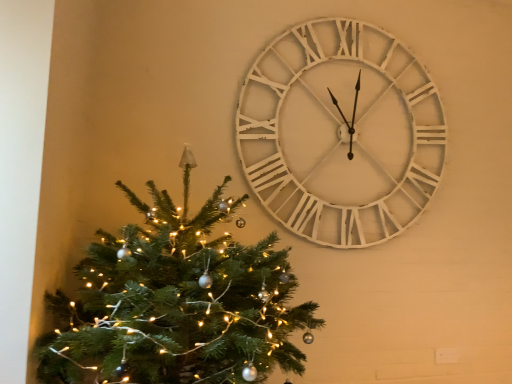
Describe the element at coordinates (340, 133) in the screenshot. The image size is (512, 384). I see `white wooden clock at upper right` at that location.

Where is `white wooden clock at upper right`? white wooden clock at upper right is located at coordinates (x=340, y=133).

Describe the element at coordinates (176, 302) in the screenshot. I see `green matte christmas tree at left` at that location.

Image resolution: width=512 pixels, height=384 pixels. I want to click on green matte christmas tree at left, so click(176, 302).

Identify the location of white wooden clock at upper right. This screenshot has height=384, width=512. (340, 133).

Considering the relative positions of green matte christmas tree at left and white wooden clock at upper right in the image provided, is green matte christmas tree at left to the left or to the right of white wooden clock at upper right?

From the image, it's evident that green matte christmas tree at left is to the left of white wooden clock at upper right.

Considering their positions, is green matte christmas tree at left located in front of or behind white wooden clock at upper right?

Clearly, green matte christmas tree at left is in front of white wooden clock at upper right.

Between point (269, 301) and point (272, 93), which one is positioned in front?

The point (269, 301) is closer.

From the image's perspective, is green matte christmas tree at left located above white wooden clock at upper right?

Incorrect, from the image's perspective, green matte christmas tree at left is lower than white wooden clock at upper right.

From a real-world perspective, is green matte christmas tree at left over white wooden clock at upper right?

Incorrect, from a real-world perspective, green matte christmas tree at left is lower than white wooden clock at upper right.

Consider the image. Between green matte christmas tree at left and white wooden clock at upper right, which one has larger width?

With larger width is green matte christmas tree at left.

From the picture: From their relative heights in the image, would you say green matte christmas tree at left is taller or shorter than white wooden clock at upper right?

Considering their sizes, green matte christmas tree at left has less height than white wooden clock at upper right.

Between green matte christmas tree at left and white wooden clock at upper right, which one has larger size?

With larger size is green matte christmas tree at left.

Can we say green matte christmas tree at left lies outside white wooden clock at upper right?

green matte christmas tree at left lies outside white wooden clock at upper right's area.

Is green matte christmas tree at left positioned far away from white wooden clock at upper right?

No, there isn't a large distance between green matte christmas tree at left and white wooden clock at upper right.

Is green matte christmas tree at left facing away from white wooden clock at upper right?

No, green matte christmas tree at left's orientation is not away from white wooden clock at upper right.

Can you tell me how much green matte christmas tree at left and white wooden clock at upper right differ in facing direction?

They differ by 1.63 degrees in their facing directions.

You are a GUI agent. You are given a task and a screenshot of the screen. Output one action in this format:
    pyautogui.click(x=<x>, y=<y>)
    Task: Click on the christmas tree below the white wooden clock at upper right (from the image's perspective)
    
    Given the screenshot: What is the action you would take?
    pyautogui.click(x=176, y=302)

Looking at this image, based on their positions, is white wooden clock at upper right located to the left or right of green matte christmas tree at left?

Based on their positions, white wooden clock at upper right is located to the right of green matte christmas tree at left.

Which object is closer to the camera, white wooden clock at upper right or green matte christmas tree at left?

Positioned in front is green matte christmas tree at left.

Which point is more forward, (366, 199) or (234, 315)?

Positioned in front is point (234, 315).

From the image's perspective, is white wooden clock at upper right above or below green matte christmas tree at left?

white wooden clock at upper right is above green matte christmas tree at left.

From a real-world perspective, who is located lower, white wooden clock at upper right or green matte christmas tree at left?

green matte christmas tree at left.

Between white wooden clock at upper right and green matte christmas tree at left, which one has larger width?

green matte christmas tree at left.

Is white wooden clock at upper right taller than green matte christmas tree at left?

Correct, white wooden clock at upper right is much taller as green matte christmas tree at left.

Is white wooden clock at upper right bigger than green matte christmas tree at left?

No, white wooden clock at upper right is not bigger than green matte christmas tree at left.

Is green matte christmas tree at left located within white wooden clock at upper right?

Definitely not — green matte christmas tree at left is not inside white wooden clock at upper right.

Is white wooden clock at upper right next to green matte christmas tree at left?

There is a gap between white wooden clock at upper right and green matte christmas tree at left.

Is white wooden clock at upper right looking in the opposite direction of green matte christmas tree at left?

No.

How many degrees apart are the facing directions of white wooden clock at upper right and green matte christmas tree at left?

The facing directions of white wooden clock at upper right and green matte christmas tree at left are 1.63 degrees apart.

Find the location of a particular element. wall clock located on the right of green matte christmas tree at left is located at coordinates (340, 133).

I want to click on christmas tree located on the left of white wooden clock at upper right, so click(176, 302).

Find the location of a particular element. christmas tree beneath the white wooden clock at upper right (from a real-world perspective) is located at coordinates [x=176, y=302].